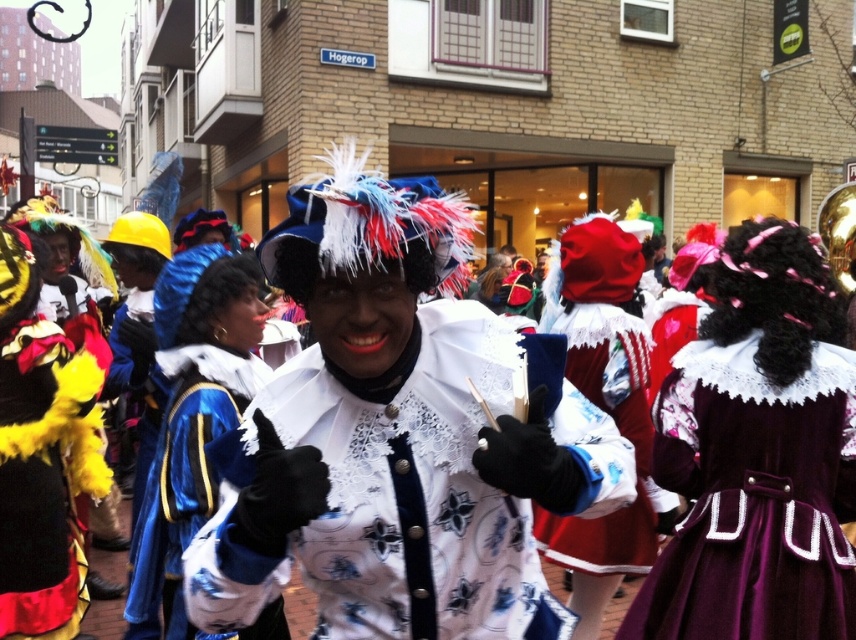
Question: Observing the image, what is the correct spatial positioning of velvet maroon dress at center in reference to white lace coat at center?

Choices:
 (A) right
 (B) left

Answer: (A)

Question: Which object is the closest to the white lace coat at center?

Choices:
 (A) velvet maroon dress at center
 (B) velvet red dress at center

Answer: (A)

Question: Can you confirm if velvet maroon dress at center is wider than velvet red dress at center?

Choices:
 (A) no
 (B) yes

Answer: (B)

Question: Which of the following is the closest to the observer?

Choices:
 (A) white lace coat at center
 (B) white lace jacket at center

Answer: (B)

Question: Considering the real-world distances, which object is farthest from the velvet red dress at center?

Choices:
 (A) white lace coat at center
 (B) velvet maroon dress at center
 (C) white lace jacket at center

Answer: (C)

Question: Considering the relative positions of white lace jacket at center and velvet maroon dress at center in the image provided, where is white lace jacket at center located with respect to velvet maroon dress at center?

Choices:
 (A) left
 (B) right

Answer: (A)